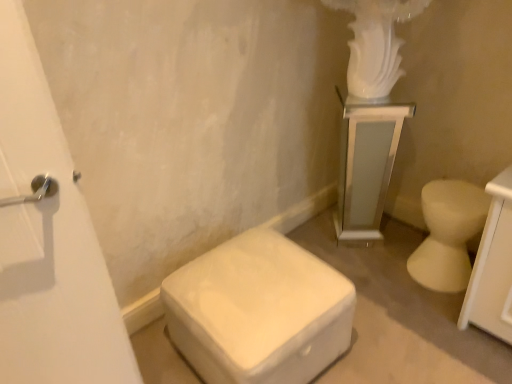
Question: Is white glossy pedestal at upper right in front of white glossy toilet at right, the 2th toilet positioned from the left?

Choices:
 (A) yes
 (B) no

Answer: (B)

Question: Is white glossy pedestal at upper right facing away from white glossy toilet at right, which is the 1th toilet from right to left?

Choices:
 (A) no
 (B) yes

Answer: (A)

Question: From the image's perspective, does white glossy pedestal at upper right appear lower than white glossy toilet at right, which is the 1th toilet from right to left?

Choices:
 (A) yes
 (B) no

Answer: (B)

Question: Can you confirm if white glossy pedestal at upper right is bigger than white glossy toilet at right, the 2th toilet positioned from the left?

Choices:
 (A) no
 (B) yes

Answer: (B)

Question: From a real-world perspective, is white glossy pedestal at upper right located beneath white glossy toilet at right, the 2th toilet positioned from the left?

Choices:
 (A) no
 (B) yes

Answer: (A)

Question: From a real-world perspective, is white glossy pedestal at upper right physically above white glossy toilet at right, which is the 1th toilet from right to left?

Choices:
 (A) yes
 (B) no

Answer: (A)

Question: Is white matte ottoman at lower center, which ranks as the 2th toilet in right-to-left order, further to the viewer compared to white glossy pedestal at upper right?

Choices:
 (A) yes
 (B) no

Answer: (B)

Question: Would you say white glossy pedestal at upper right is part of white matte ottoman at lower center, which ranks as the 2th toilet in right-to-left order,'s contents?

Choices:
 (A) no
 (B) yes

Answer: (A)

Question: Are white matte ottoman at lower center, which ranks as the first toilet in left-to-right order, and white glossy pedestal at upper right located far from each other?

Choices:
 (A) no
 (B) yes

Answer: (A)

Question: Is white matte ottoman at lower center, which ranks as the first toilet in left-to-right order, in front of white glossy pedestal at upper right?

Choices:
 (A) no
 (B) yes

Answer: (B)

Question: From the image's perspective, is white matte ottoman at lower center, which ranks as the 2th toilet in right-to-left order, under white glossy pedestal at upper right?

Choices:
 (A) no
 (B) yes

Answer: (B)

Question: Is white matte ottoman at lower center, which ranks as the 2th toilet in right-to-left order, thinner than white glossy pedestal at upper right?

Choices:
 (A) no
 (B) yes

Answer: (A)

Question: Does white matte ottoman at lower center, which ranks as the first toilet in left-to-right order, have a smaller size compared to white glossy toilet at right, which is the 1th toilet from right to left?

Choices:
 (A) yes
 (B) no

Answer: (B)